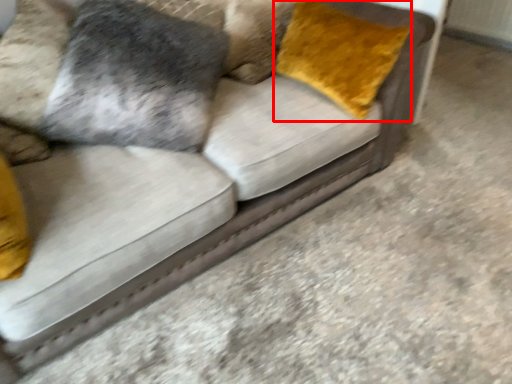
Question: From the image's perspective, where is throw pillow (annotated by the red box) located in relation to pillow in the image?

Choices:
 (A) below
 (B) above

Answer: (A)